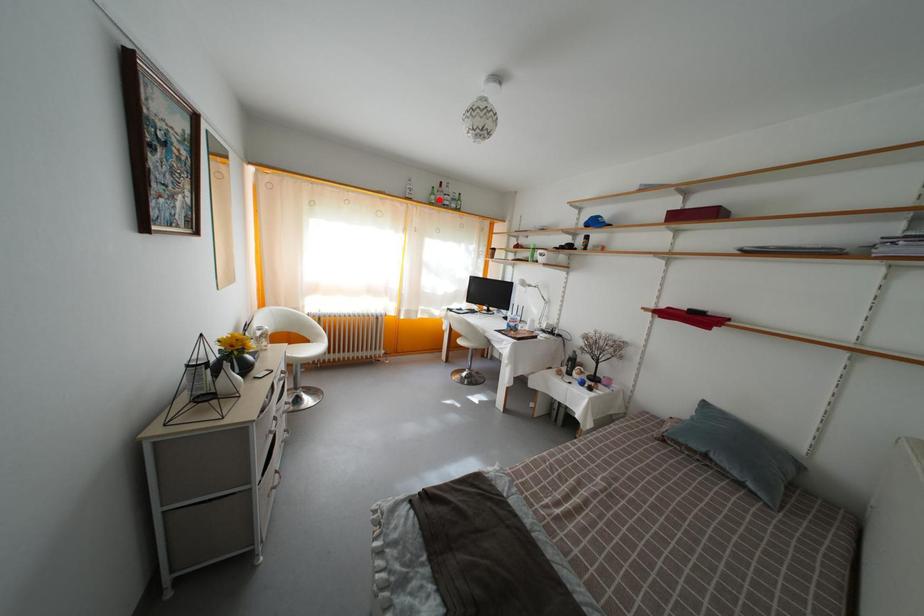
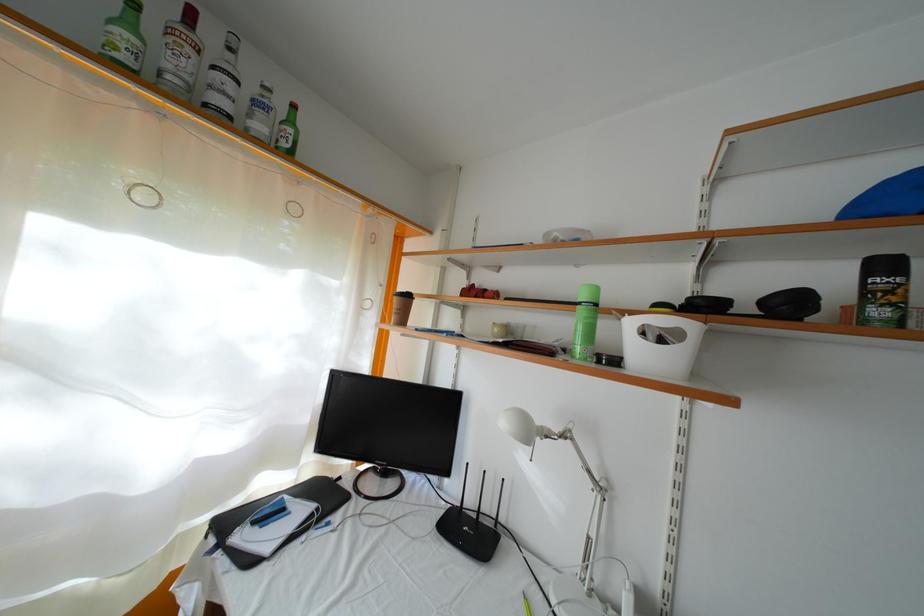
In the second image, find the point that corresponds to the highlighted location in the first image.

(134, 31)